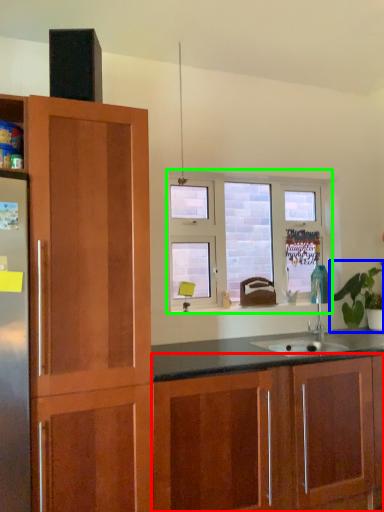
Question: Estimate the real-world distances between objects in this image. Which object is farther from cabinetry (highlighted by a red box), houseplant (highlighted by a blue box) or window (highlighted by a green box)?

Choices:
 (A) houseplant
 (B) window

Answer: (B)